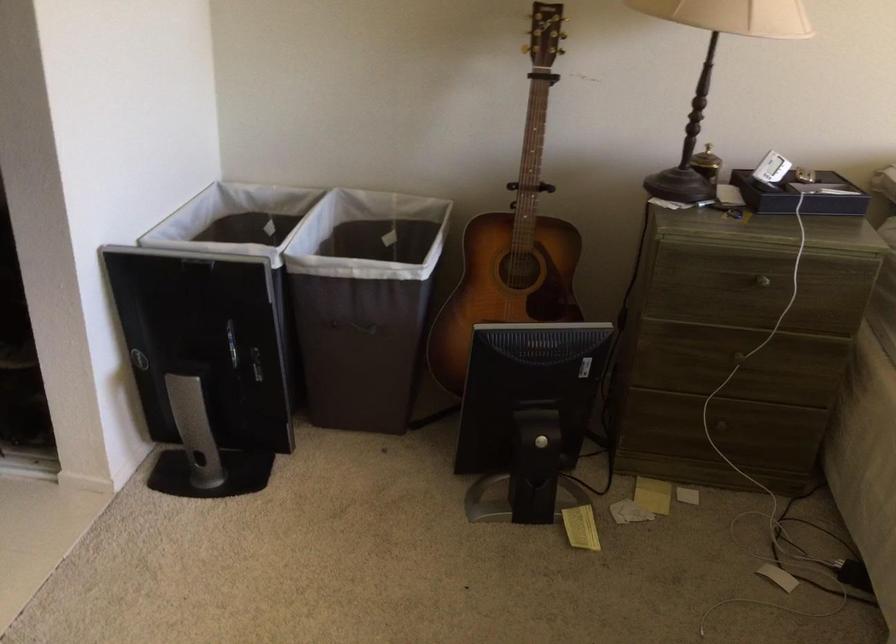
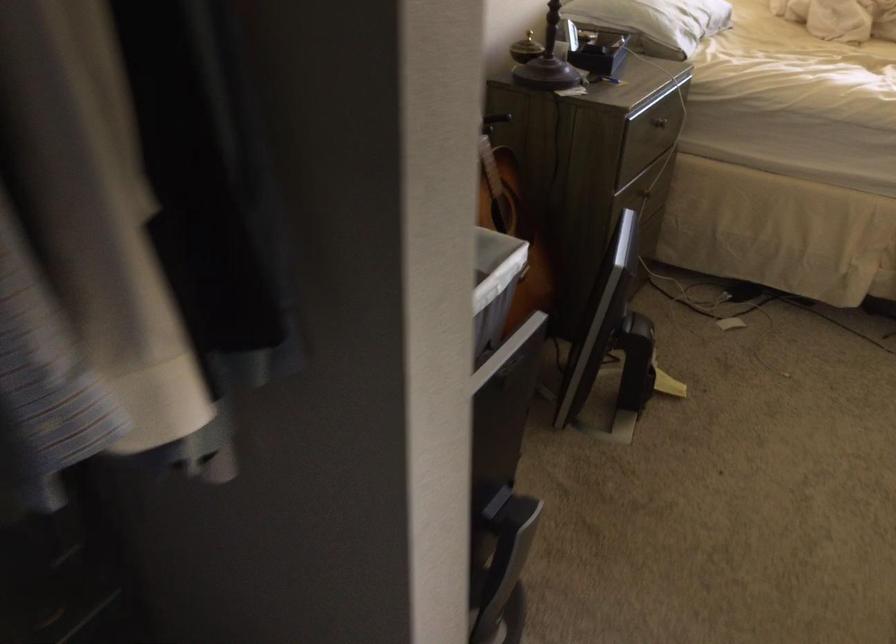
Question: I am providing you with two images of the same scene from different viewpoints. After the viewpoint changes to image2, which objects are now occluded?

Choices:
 (A) white hamper
 (B) acoustic guitar
 (C) drawer knob
 (D) yellow toy handle

Answer: (B)